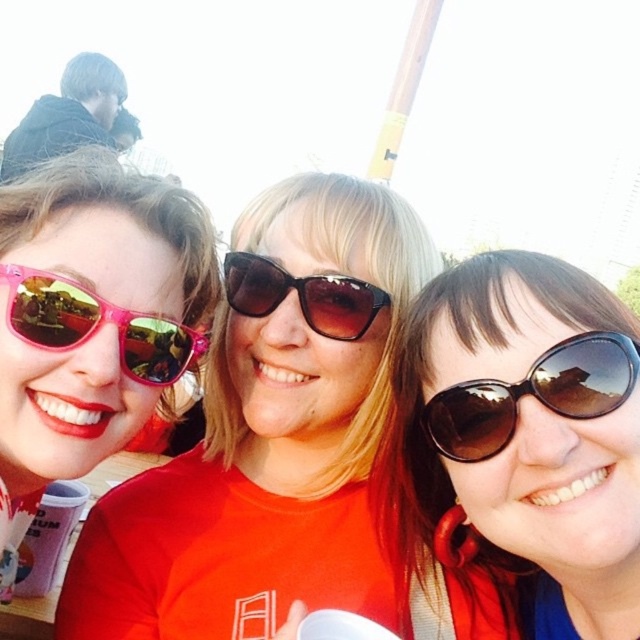
Does brown reflective sunglasses at center have a smaller size compared to brown reflective sunglasses at right?

No, brown reflective sunglasses at center is not smaller than brown reflective sunglasses at right.

In the scene shown: Between brown reflective sunglasses at center and brown reflective sunglasses at right, which one appears on the left side from the viewer's perspective?

Positioned to the left is brown reflective sunglasses at center.

Who is more forward, (532, 632) or (614, 364)?

Point (614, 364) is in front.

This screenshot has height=640, width=640. I want to click on brown reflective sunglasses at center, so click(x=518, y=449).

Image resolution: width=640 pixels, height=640 pixels. Describe the element at coordinates (518, 449) in the screenshot. I see `brown reflective sunglasses at center` at that location.

Between point (592, 305) and point (116, 310), which one is positioned in front?

Point (592, 305)

Locate an element on the screen. The width and height of the screenshot is (640, 640). brown reflective sunglasses at center is located at coordinates (518, 449).

Who is more distant from viewer, (561,403) or (56,298)?

Positioned behind is point (56,298).

Does point (493, 385) come in front of point (8, 282)?

That is True.

Find the location of a particular element. The height and width of the screenshot is (640, 640). brown reflective sunglasses at right is located at coordinates (532, 394).